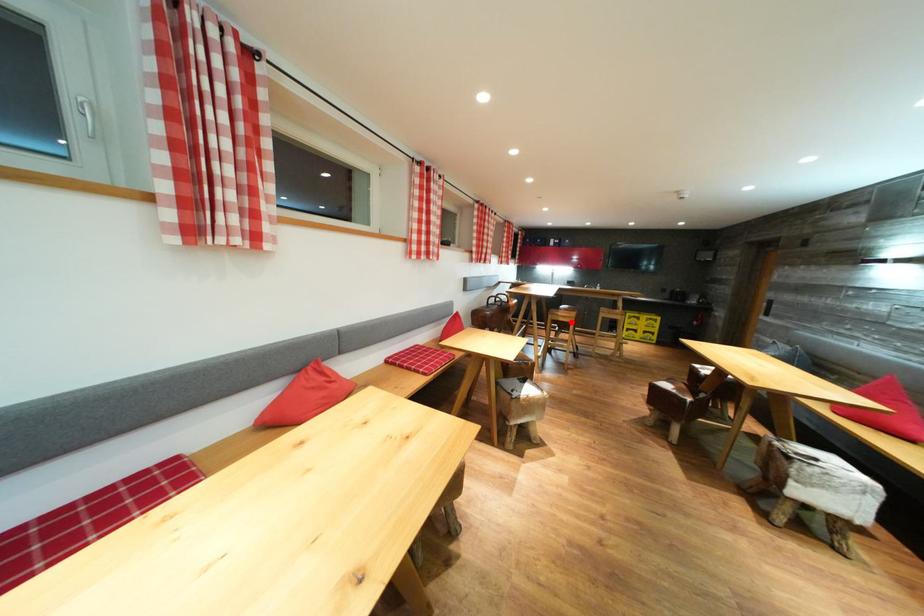
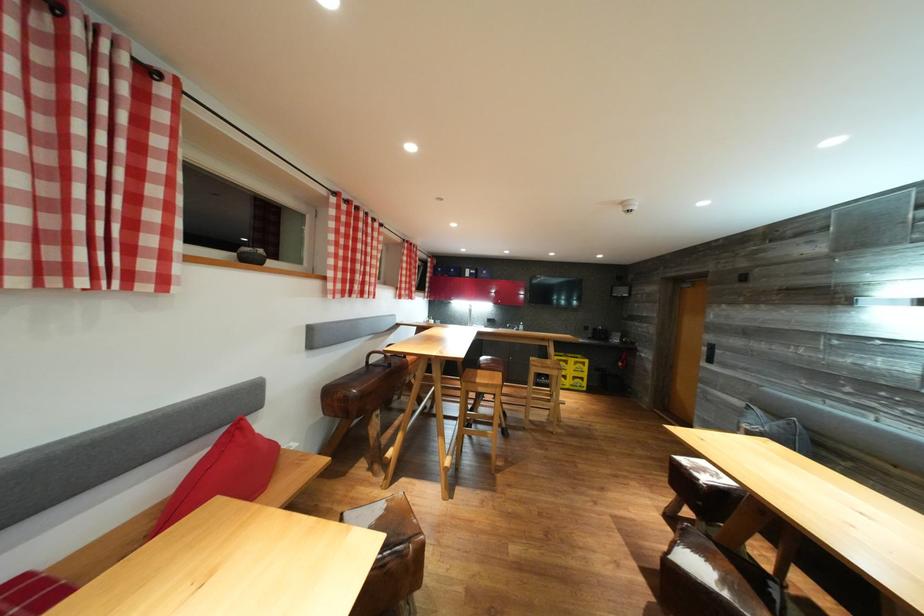
In the second image, find the point that corresponds to the highlighted location in the first image.

(492, 391)